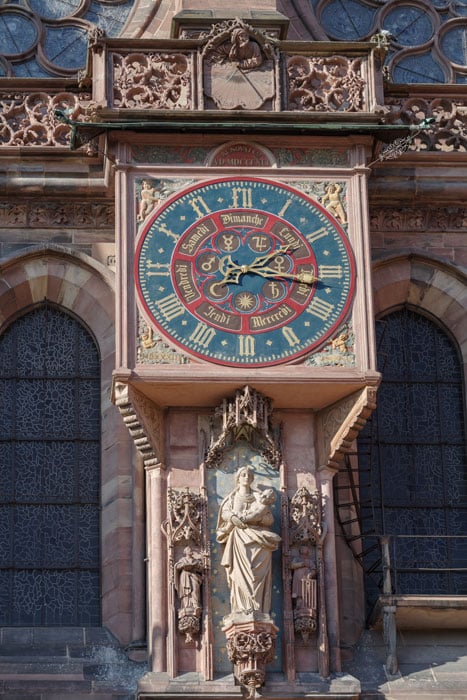
Where is `the right legs of bench`? the right legs of bench is located at coordinates (390, 636).